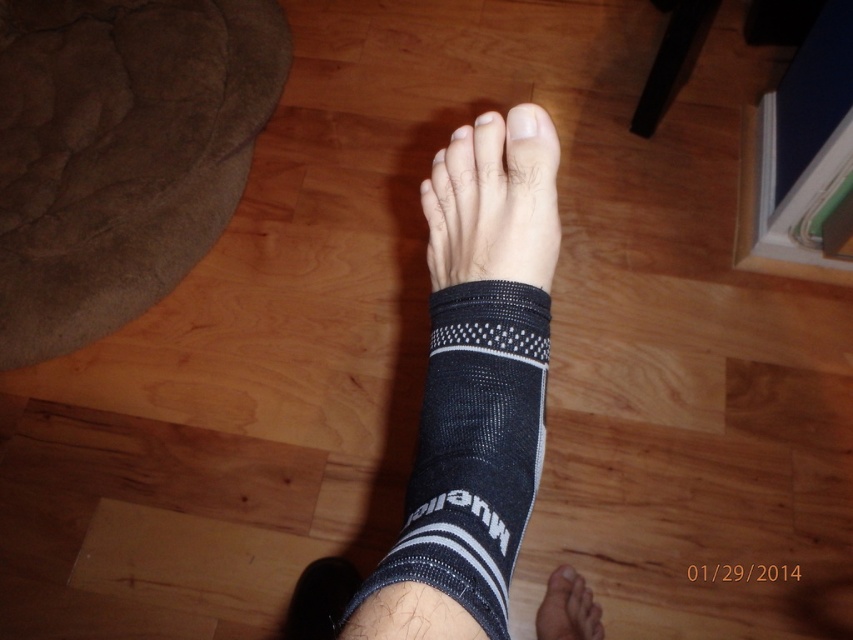
Is point (403, 568) farther from viewer compared to point (515, 138)?

No, (403, 568) is in front of (515, 138).

Can you confirm if black mesh sock at center is positioned below white matte nail at upper center?

Yes.

Does point (392, 557) come closer to viewer compared to point (532, 131)?

Yes.

This screenshot has height=640, width=853. What are the coordinates of `black mesh sock at center` in the screenshot? It's located at click(473, 449).

This screenshot has width=853, height=640. I want to click on black mesh sock at lower center, so click(567, 609).

Is point (566, 579) farther from camera compared to point (451, 138)?

Yes, it is.

At what (x,y) coordinates should I click in order to perform the action: click on black mesh sock at lower center. Please return your answer as a coordinate pair (x, y). This screenshot has height=640, width=853. Looking at the image, I should click on (567, 609).

Which of these two, black mesh bandage at center or white matte toe at center, stands shorter?

white matte toe at center

Image resolution: width=853 pixels, height=640 pixels. What do you see at coordinates (492, 208) in the screenshot? I see `black mesh bandage at center` at bounding box center [492, 208].

What do you see at coordinates (492, 208) in the screenshot? I see `black mesh bandage at center` at bounding box center [492, 208].

You are a GUI agent. You are given a task and a screenshot of the screen. Output one action in this format:
    pyautogui.click(x=<x>, y=<y>)
    Task: Click on the black mesh bandage at center
    The width and height of the screenshot is (853, 640).
    Given the screenshot: What is the action you would take?
    pyautogui.click(x=492, y=208)